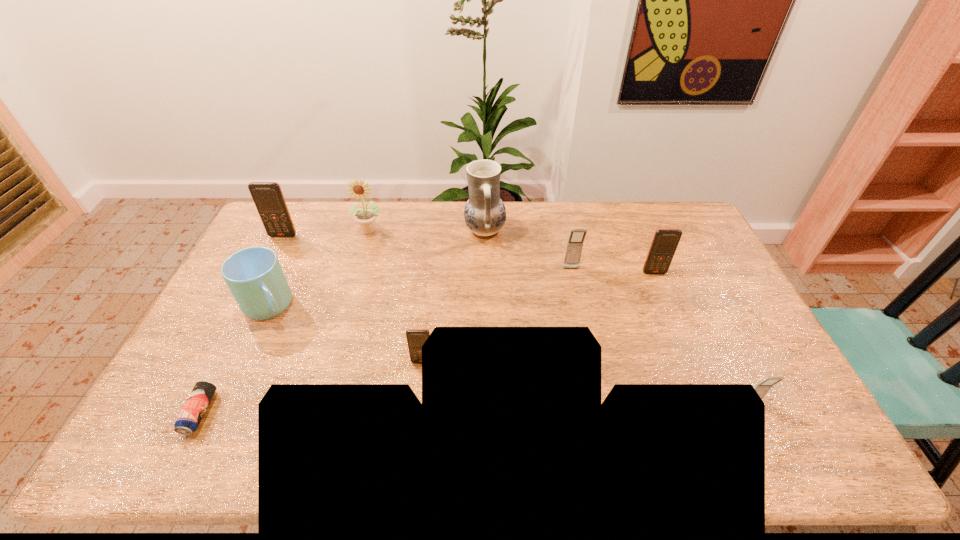
You are a GUI agent. You are given a task and a screenshot of the screen. Output one action in this format:
    pyautogui.click(x=<x>, y=<y>)
    Task: Click on the blank space at the far right corner of the desktop
    
    Given the screenshot: What is the action you would take?
    pyautogui.click(x=649, y=211)

Where is `vacant area that lies between the nearest cellular telephone and the fourth cellular telephone from left to right`? vacant area that lies between the nearest cellular telephone and the fourth cellular telephone from left to right is located at coordinates (703, 339).

At what (x,y) coordinates should I click in order to perform the action: click on vacant space that's between the pottery and the shortest object. Please return your answer as a coordinate pair (x, y). Looking at the image, I should click on (343, 322).

This screenshot has width=960, height=540. In order to click on vacant space in between the yellow sunflower and the mug in this screenshot , I will do `click(320, 268)`.

At what (x,y) coordinates should I click in order to perform the action: click on free space that is in between the sixth farthest object and the shortest object. Please return your answer as a coordinate pair (x, y). Looking at the image, I should click on (234, 360).

This screenshot has width=960, height=540. In order to click on empty space between the biggest orange cellular telephone and the rightmost cellular telephone in this screenshot , I will do `click(517, 320)`.

Locate an element on the screen. The image size is (960, 540). vacant region between the rightmost orange cellular telephone and the bigger gray cellular telephone is located at coordinates (612, 271).

This screenshot has height=540, width=960. Identify the location of free space between the second nearest orange cellular telephone and the farther gray cellular telephone. point(612,271).

Locate an element on the screen. empty location between the blue beer can and the second biggest orange cellular telephone is located at coordinates (427, 342).

Image resolution: width=960 pixels, height=540 pixels. I want to click on vacant region between the sunflower and the nearest orange cellular telephone, so click(x=396, y=295).